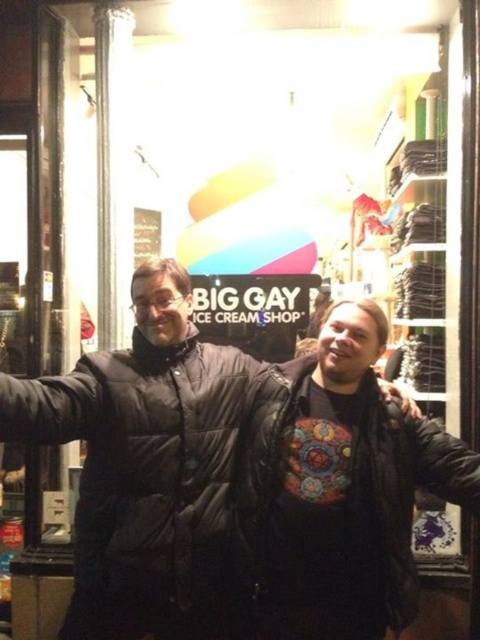
Question: Is black puffy jacket at center above leather jacket at center?

Choices:
 (A) yes
 (B) no

Answer: (A)

Question: Is black puffy jacket at center positioned at the back of leather jacket at center?

Choices:
 (A) no
 (B) yes

Answer: (A)

Question: Which object is farther from the camera taking this photo?

Choices:
 (A) black puffy jacket at center
 (B) leather jacket at center

Answer: (B)

Question: Where is black puffy jacket at center located in relation to leather jacket at center in the image?

Choices:
 (A) below
 (B) above

Answer: (B)

Question: Which object appears farthest from the camera in this image?

Choices:
 (A) leather jacket at center
 (B) black puffy jacket at center

Answer: (A)